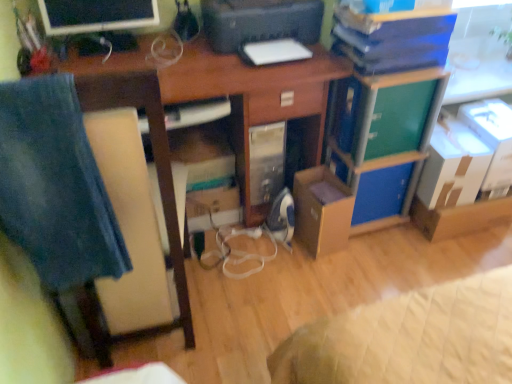
Find the location of a particular element. vacant space to the right of brown cardboard box at center, arranged as the 1th cardboard box when viewed from the left is located at coordinates (372, 246).